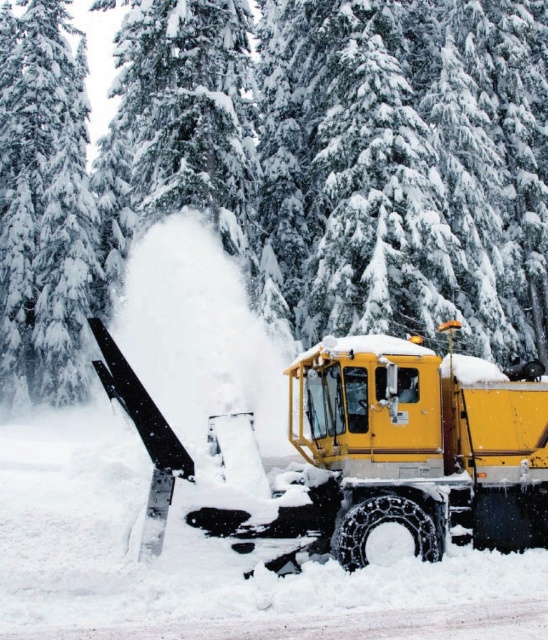
Question: Is snow-covered pine tree at center thinner than white snow-covered tree at left?

Choices:
 (A) yes
 (B) no

Answer: (B)

Question: Does snow-covered pine tree at center appear on the right side of white snow-covered tree at left?

Choices:
 (A) no
 (B) yes

Answer: (B)

Question: Which point is farther to the camera?

Choices:
 (A) (470, 236)
 (B) (248, 525)

Answer: (A)

Question: Which of these objects is positioned farthest from the snow-covered pine tree at center?

Choices:
 (A) white snow-covered tree at left
 (B) yellow matte/snow-covered snowplow at center

Answer: (B)

Question: Does yellow matte/snow-covered snowplow at center have a smaller size compared to white snow-covered tree at left?

Choices:
 (A) yes
 (B) no

Answer: (A)

Question: Among these objects, which one is farthest from the camera?

Choices:
 (A) yellow matte/snow-covered snowplow at center
 (B) snow-covered pine tree at center
 (C) white snow-covered tree at left

Answer: (C)